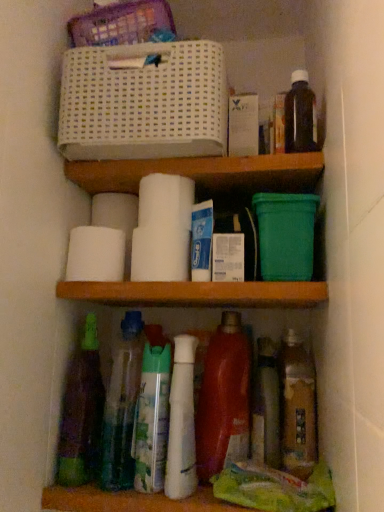
Question: Is translucent plastic bottles at center, marked as the seventh bottle in a right-to-left arrangement, wider or thinner than white matte toilet paper at center, which is the 1th toilet paper in front-to-back order?

Choices:
 (A) thin
 (B) wide

Answer: (B)

Question: From the image's perspective, is translucent plastic bottles at center, the second bottle when ordered from left to right, above or below white matte toilet paper at center, which is the 1th toilet paper in front-to-back order?

Choices:
 (A) above
 (B) below

Answer: (B)

Question: Which object is positioned closest to the dark brown glass bottle at upper right, which is the 1th bottle in right-to-left order?

Choices:
 (A) translucent plastic spray bottle at lower center, positioned as the 6th bottle in right-to-left order
 (B) translucent plastic bottle at lower right, which is counted as the 2th bottle, starting from the right
 (C) translucent plastic bottle at lower center, the third bottle viewed from the right
 (D) white plastic basket at upper center
 (E) white glossy bottle at center, the fifth bottle viewed from the right

Answer: (D)

Question: Which object is the farthest from the white matte toilet paper at center, the 3th toilet paper viewed from the back?

Choices:
 (A) shiny red plastic bottle at lower center, marked as the fourth bottle in a right-to-left arrangement
 (B) white glossy bottle at center, which is counted as the fourth bottle, starting from the left
 (C) white plastic basket at upper center
 (D) dark brown glass bottle at upper right, which is the 1th bottle in right-to-left order
 (E) translucent plastic bottle at lower right, acting as the seventh bottle starting from the left

Answer: (E)